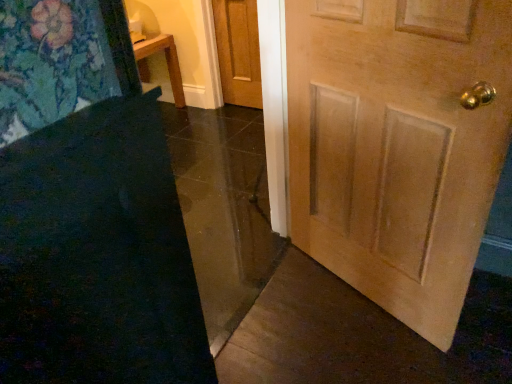
Find the location of a particular element. This screenshot has height=384, width=512. light brown wood door at center, which is the second door from right to left is located at coordinates (238, 51).

Image resolution: width=512 pixels, height=384 pixels. Find the location of `dark blue carpet at lower left`. dark blue carpet at lower left is located at coordinates (97, 255).

Between light brown wood door at center, which is the second door from right to left, and light brown wood door at center, the 2th door viewed from the back, which one has larger size?

light brown wood door at center, the 2th door viewed from the back.

Are light brown wood door at center, the 1th door from the top, and light brown wood door at center, marked as the second door in a top-to-bottom arrangement, located far from each other?

Yes, light brown wood door at center, the 1th door from the top, and light brown wood door at center, marked as the second door in a top-to-bottom arrangement, are located far from each other.

Considering the relative sizes of light brown wood door at center, the 1th door from the top, and light brown wood door at center, the second door positioned from the left, in the image provided, is light brown wood door at center, the 1th door from the top, thinner than light brown wood door at center, the second door positioned from the left,?

Yes.

From the image's perspective, which is above, light brown wood door at center, which is the second door from right to left, or light brown wood door at center, the 2th door viewed from the back?

light brown wood door at center, which is the second door from right to left, appears higher in the image.

Is point (440, 74) farther from camera compared to point (239, 38)?

No, (440, 74) is closer to viewer.

From the image's perspective, which is below, light brown wood door at center, the 2th door viewed from the back, or light brown wood door at center, which ranks as the 2th door in front-to-back order?

light brown wood door at center, the 2th door viewed from the back.

From a real-world perspective, is light brown wood door at center, marked as the second door in a top-to-bottom arrangement, beneath light brown wood door at center, the 1th door from the back?

Incorrect, from a real-world perspective, light brown wood door at center, marked as the second door in a top-to-bottom arrangement, is higher than light brown wood door at center, the 1th door from the back.

Is light brown wood door at center, the 2th door viewed from the back, touching light brown wood door at center, the 1th door from the back?

No, light brown wood door at center, the 2th door viewed from the back, is not with light brown wood door at center, the 1th door from the back.

Is dark blue carpet at lower left not close to light brown wood door at center, which ranks as the 1th door in bottom-to-top order?

No, dark blue carpet at lower left is in close proximity to light brown wood door at center, which ranks as the 1th door in bottom-to-top order.

Is dark blue carpet at lower left located outside light brown wood door at center, marked as the first door in a right-to-left arrangement?

dark blue carpet at lower left is positioned outside light brown wood door at center, marked as the first door in a right-to-left arrangement.

From the image's perspective, which is below, dark blue carpet at lower left or light brown wood door at center, marked as the first door in a right-to-left arrangement?

dark blue carpet at lower left, from the image's perspective.

Can you confirm if dark blue carpet at lower left is taller than light brown wood door at center, the 2th door viewed from the back?

Incorrect, the height of dark blue carpet at lower left is not larger of that of light brown wood door at center, the 2th door viewed from the back.

From the picture: From the image's perspective, does dark blue carpet at lower left appear lower than light brown wood door at center, the 1th door from the back?

Yes.

Is point (22, 240) in front of point (249, 12)?

Yes.

From a real-world perspective, is dark blue carpet at lower left positioned above or below light brown wood door at center, the first door when ordered from left to right?

dark blue carpet at lower left is situated higher than light brown wood door at center, the first door when ordered from left to right, in the real world.

Which of these two, dark blue carpet at lower left or light brown wood door at center, the first door when ordered from left to right, stands taller?

Answer: dark blue carpet at lower left.

How many degrees apart are the facing directions of light brown wood door at center, marked as the first door in a right-to-left arrangement, and dark blue carpet at lower left?

light brown wood door at center, marked as the first door in a right-to-left arrangement, and dark blue carpet at lower left are facing 111 degrees away from each other.

Considering the relative sizes of light brown wood door at center, marked as the first door in a right-to-left arrangement, and dark blue carpet at lower left in the image provided, is light brown wood door at center, marked as the first door in a right-to-left arrangement, wider than dark blue carpet at lower left?

Indeed, light brown wood door at center, marked as the first door in a right-to-left arrangement, has a greater width compared to dark blue carpet at lower left.

Considering the points (490, 190) and (63, 244), which point is behind, point (490, 190) or point (63, 244)?

The point (490, 190) is farther.

From a real-world perspective, does light brown wood door at center, marked as the second door in a top-to-bottom arrangement, stand above dark blue carpet at lower left?

Yes, from a real-world perspective, light brown wood door at center, marked as the second door in a top-to-bottom arrangement, is above dark blue carpet at lower left.

Would you consider light brown wood door at center, the 1th door from the back, to be distant from dark blue carpet at lower left?

Indeed, light brown wood door at center, the 1th door from the back, is not near dark blue carpet at lower left.

The width and height of the screenshot is (512, 384). I want to click on doormat below the light brown wood door at center, which ranks as the 2th door in front-to-back order (from the image's perspective), so click(x=97, y=255).

Which is in front, point (225, 75) or point (147, 361)?

The point (147, 361) is more forward.

Is light brown wood door at center, which ranks as the 2th door in front-to-back order, positioned with its back to dark blue carpet at lower left?

light brown wood door at center, which ranks as the 2th door in front-to-back order, is not turned away from dark blue carpet at lower left.

Find the location of a particular element. The height and width of the screenshot is (384, 512). door below the light brown wood door at center, the 2th door viewed from the back (from a real-world perspective) is located at coordinates (238, 51).

The image size is (512, 384). In order to click on door that is in front of the light brown wood door at center, the 1th door from the back in this screenshot , I will do `click(398, 145)`.

Looking at the image, which one is located further to dark blue carpet at lower left, light brown wood door at center, marked as the second door in a top-to-bottom arrangement, or light brown wood door at center, which is the second door from right to left?

The object further to dark blue carpet at lower left is light brown wood door at center, which is the second door from right to left.

In the scene shown: Which object lies nearer to the anchor point light brown wood door at center, marked as the second door in a top-to-bottom arrangement, dark blue carpet at lower left or light brown wood door at center, which ranks as the 2th door in front-to-back order?

The object closer to light brown wood door at center, marked as the second door in a top-to-bottom arrangement, is dark blue carpet at lower left.

When comparing their distances from light brown wood door at center, which is the second door from right to left, does dark blue carpet at lower left or light brown wood door at center, marked as the second door in a top-to-bottom arrangement, seem further?

The object further to light brown wood door at center, which is the second door from right to left, is dark blue carpet at lower left.

Based on their spatial positions, is light brown wood door at center, which ranks as the 1th door in front-to-back order, or dark blue carpet at lower left further from light brown wood door at center, the 2th door in the bottom-to-top sequence?

Based on the image, dark blue carpet at lower left appears to be further to light brown wood door at center, the 2th door in the bottom-to-top sequence.

Estimate the real-world distances between objects in this image. Which object is closer to light brown wood door at center, marked as the first door in a right-to-left arrangement, light brown wood door at center, the 2th door in the bottom-to-top sequence, or dark blue carpet at lower left?

dark blue carpet at lower left is positioned closer to the anchor light brown wood door at center, marked as the first door in a right-to-left arrangement.

Considering their positions, is light brown wood door at center, the 2th door in the bottom-to-top sequence, positioned further to dark blue carpet at lower left than light brown wood door at center, the 2th door viewed from the back?

light brown wood door at center, the 2th door in the bottom-to-top sequence, lies further to dark blue carpet at lower left than the other object.

I want to click on door between dark blue carpet at lower left and light brown wood door at center, the 2th door in the bottom-to-top sequence, along the z-axis, so coord(398,145).